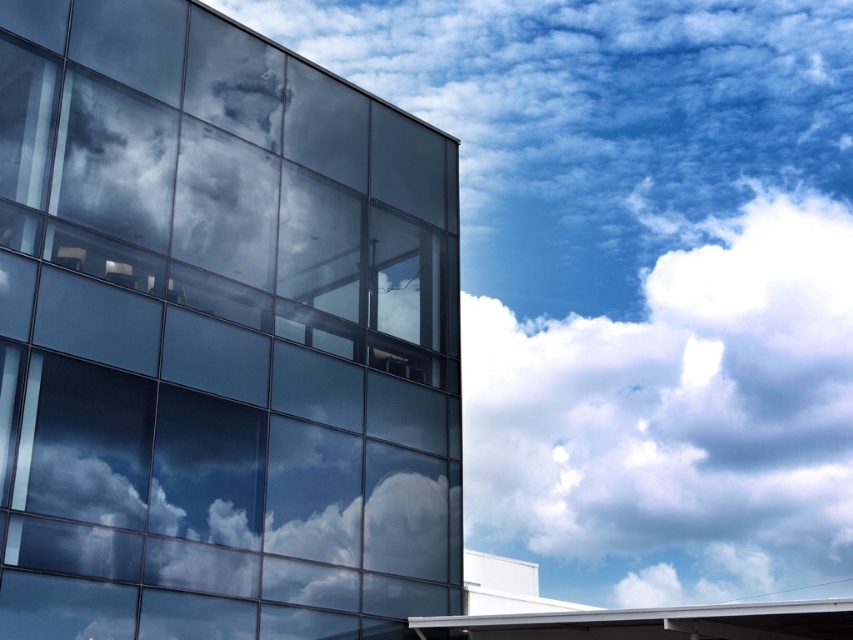
Which is behind, point (126, 54) or point (798, 224)?

Positioned behind is point (798, 224).

Based on the photo, is transparent glass window at left behind white fluffy cloud at upper right?

No.

Identify the location of transparent glass window at left. (218, 337).